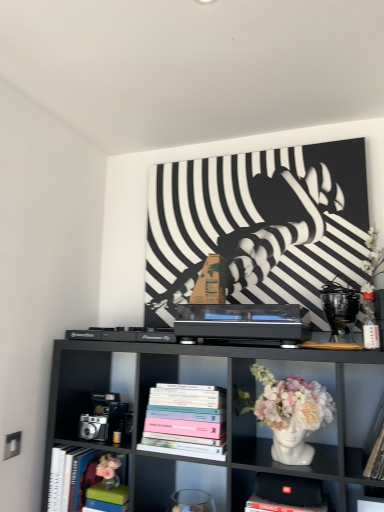
Question: From the image's perspective, is black fabric speaker at lower center, which is counted as the first shelf, starting from the bottom, above hardcover books at center, which is counted as the second book, starting from the bottom?

Choices:
 (A) no
 (B) yes

Answer: (A)

Question: Is black fabric speaker at lower center, which is counted as the first shelf, starting from the bottom, in contact with hardcover books at center, positioned as the first book in top-to-bottom order?

Choices:
 (A) yes
 (B) no

Answer: (B)

Question: Can you confirm if black fabric speaker at lower center, which is counted as the first shelf, starting from the bottom, is positioned to the left of hardcover books at center, placed as the 1th book when sorted from right to left?

Choices:
 (A) no
 (B) yes

Answer: (A)

Question: Is black fabric speaker at lower center, which ranks as the 2th shelf in top-to-bottom order, turned away from hardcover books at center, positioned as the first book in top-to-bottom order?

Choices:
 (A) yes
 (B) no

Answer: (B)

Question: From a real-world perspective, is black fabric speaker at lower center, which ranks as the 2th shelf in top-to-bottom order, over hardcover books at center, which is counted as the second book, starting from the bottom?

Choices:
 (A) no
 (B) yes

Answer: (A)

Question: Is point (291, 437) positioned closer to the camera than point (102, 407)?

Choices:
 (A) farther
 (B) closer

Answer: (B)

Question: Considering the positions of white glossy vase at center and metallic silver camera at lower left, the 1th toy from the left, in the image, is white glossy vase at center wider or thinner than metallic silver camera at lower left, the 1th toy from the left,?

Choices:
 (A) wide
 (B) thin

Answer: (A)

Question: Is white glossy vase at center in front of or behind metallic silver camera at lower left, positioned as the second toy in top-to-bottom order, in the image?

Choices:
 (A) behind
 (B) front

Answer: (B)

Question: From a real-world perspective, relative to metallic silver camera at lower left, arranged as the 2th toy when viewed from the right, is white glossy vase at center vertically above or below?

Choices:
 (A) above
 (B) below

Answer: (A)

Question: In terms of height, does white glossy vase at center look taller or shorter compared to black fabric speaker at lower center, which is counted as the first shelf, starting from the bottom?

Choices:
 (A) short
 (B) tall

Answer: (B)

Question: From the image's perspective, relative to black fabric speaker at lower center, which ranks as the 2th shelf in top-to-bottom order, is white glossy vase at center above or below?

Choices:
 (A) above
 (B) below

Answer: (A)

Question: Which is correct: white glossy vase at center is inside black fabric speaker at lower center, which ranks as the 2th shelf in top-to-bottom order, or outside of it?

Choices:
 (A) outside
 (B) inside

Answer: (A)

Question: Is white glossy vase at center bigger or smaller than black fabric speaker at lower center, which is counted as the first shelf, starting from the bottom?

Choices:
 (A) small
 (B) big

Answer: (B)

Question: Does point (334, 438) appear closer or farther from the camera than point (79, 462)?

Choices:
 (A) farther
 (B) closer

Answer: (B)

Question: Is black matte shelf at center, the 2th shelf positioned from the bottom, wider or thinner than hardcover book at left, placed as the 1th book when sorted from left to right?

Choices:
 (A) thin
 (B) wide

Answer: (B)